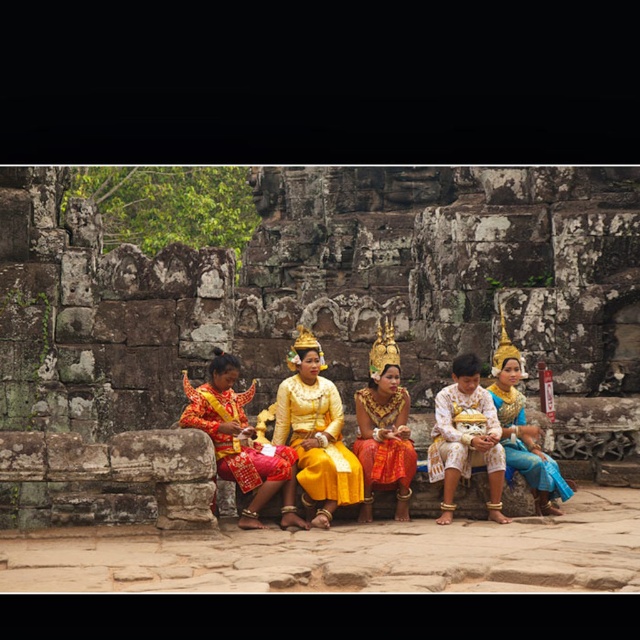
You are a photographer standing in front of the stone wall. You want to take a photo of the white satin costume at center and the yellow satin dress at center. If your camera can focus on objects within 5 meters, will both subjects be in focus?

Answer: The white satin costume at center is 6.06 meters away from yellow satin dress at center. Since the distance between them exceeds the camera focus range of 5 meters, both subjects cannot be in focus simultaneously.

You are an artist observing the scene and want to sketch the white satin costume at center and the yellow satin dress at center. Which one should you draw first if you want to capture the one that is visually in front?

The white satin costume at center is positioned over yellow satin dress at center, so you should draw the white satin costume at center first to capture the one in front.